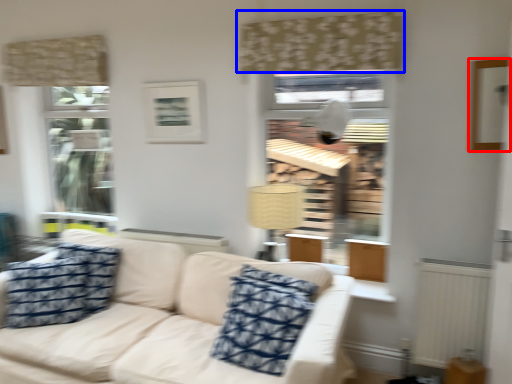
Question: Which object appears closest to the camera in this image, picture frame (highlighted by a red box) or curtain (highlighted by a blue box)?

Choices:
 (A) picture frame
 (B) curtain

Answer: (A)